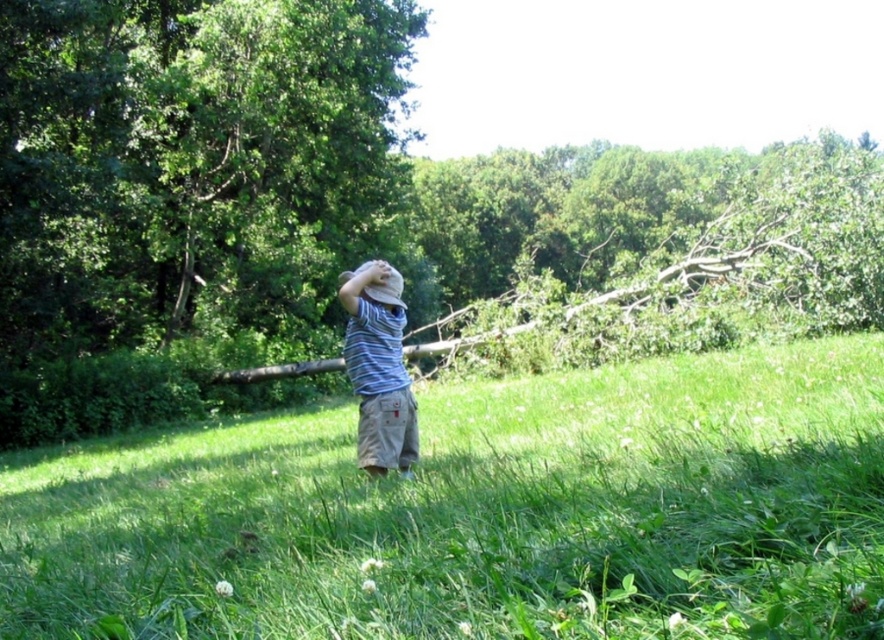
Is green grassy at center shorter than striped cotton shirt at center?

Indeed, green grassy at center has a lesser height compared to striped cotton shirt at center.

Is point (568, 624) closer to camera compared to point (379, 365)?

Yes, it is in front of point (379, 365).

Where is `green grassy at center`? This screenshot has width=884, height=640. green grassy at center is located at coordinates (481, 513).

Which is above, brown wood log at center or striped cotton shirt at center?

brown wood log at center is above.

Can you confirm if brown wood log at center is smaller than striped cotton shirt at center?

No.

Describe the element at coordinates (256, 196) in the screenshot. I see `brown wood log at center` at that location.

Image resolution: width=884 pixels, height=640 pixels. Identify the location of brown wood log at center. (256, 196).

Is green grassy at center above brown wood log at center?

No, green grassy at center is not above brown wood log at center.

Is green grassy at center below brown wood log at center?

Yes.

Is point (333, 588) more distant than point (88, 51)?

No, (333, 588) is in front of (88, 51).

Locate an element on the screen. The image size is (884, 640). green grassy at center is located at coordinates (481, 513).